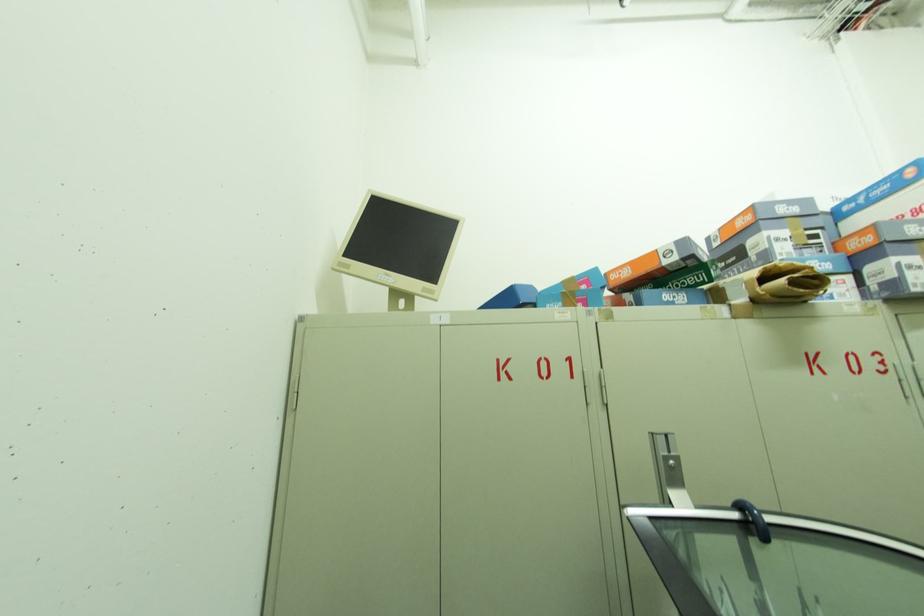
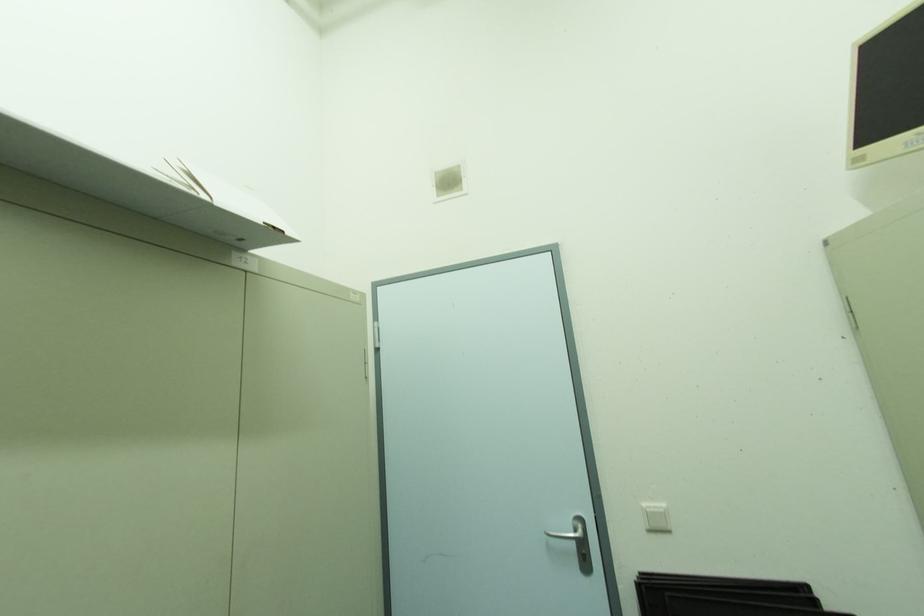
Question: The camera is either moving clockwise (left) or counter-clockwise (right) around the object. The first image is from the beginning of the video and the second image is from the end. Is the camera moving left or right when shooting the video?

Choices:
 (A) Left
 (B) Right

Answer: (B)